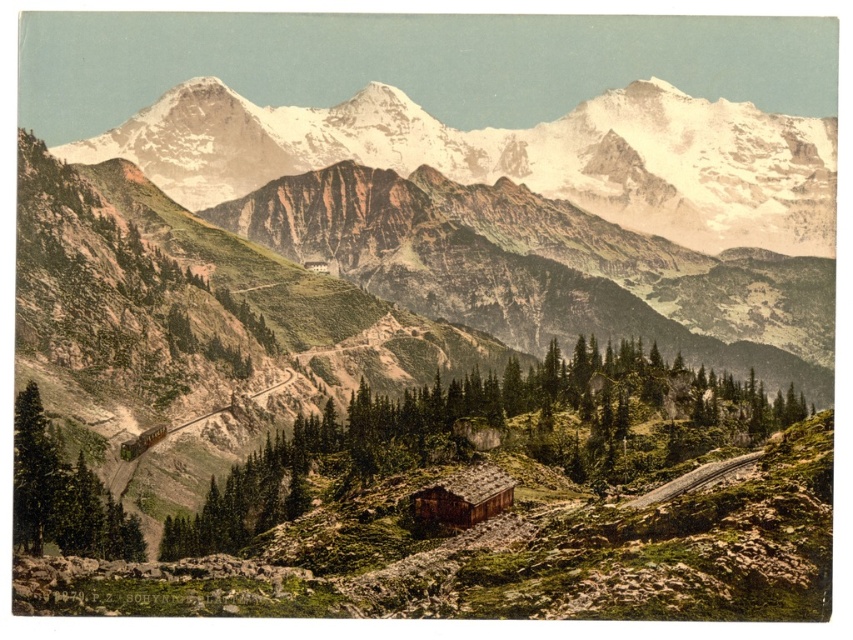
Which is below, snowy granite mountains at upper center or green textured tree at lower left?

Positioned lower is green textured tree at lower left.

Based on the photo, who is taller, snowy granite mountains at upper center or green textured tree at lower left?

With more height is snowy granite mountains at upper center.

This screenshot has width=853, height=640. What do you see at coordinates (515, 157) in the screenshot?
I see `snowy granite mountains at upper center` at bounding box center [515, 157].

Identify the location of snowy granite mountains at upper center. Image resolution: width=853 pixels, height=640 pixels. (515, 157).

Can you confirm if green textured log cabin at center is positioned to the left of green textured tree at lower left?

Incorrect, green textured log cabin at center is not on the left side of green textured tree at lower left.

Based on the photo, does green textured log cabin at center appear on the right side of green textured tree at lower left?

Yes, green textured log cabin at center is to the right of green textured tree at lower left.

Locate an element on the screen. The image size is (853, 640). green textured log cabin at center is located at coordinates (486, 428).

The width and height of the screenshot is (853, 640). In order to click on green textured log cabin at center in this screenshot , I will do `click(486, 428)`.

Is point (515, 177) behind point (682, 449)?

Yes, point (515, 177) is farther from viewer.

Which is in front, point (178, 86) or point (363, 438)?

Point (363, 438) is more forward.

This screenshot has width=853, height=640. What are the coordinates of `snowy granite mountains at upper center` in the screenshot? It's located at (515, 157).